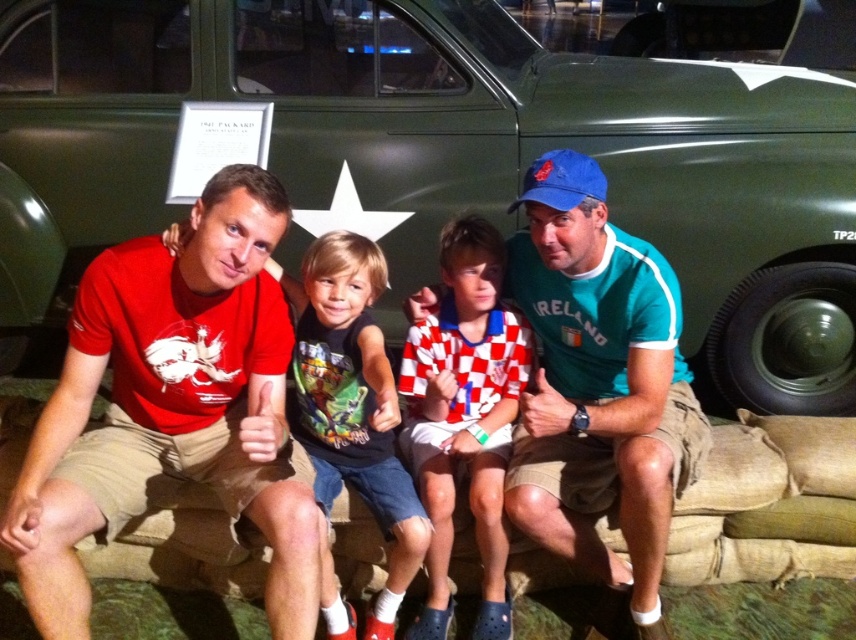
You are standing in front of the vintage military truck and want to place a small flag at the point closer to you between the two points marked as point (x=254, y=388) and point (x=617, y=273). Which point should you choose?

You should choose point (x=254, y=388) because it is closer to the viewer than point (x=617, y=273).